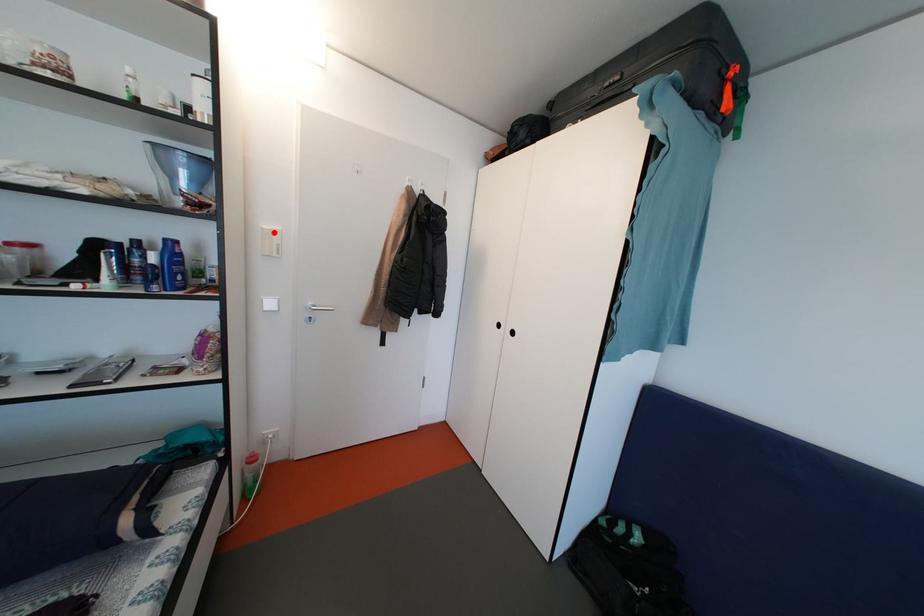
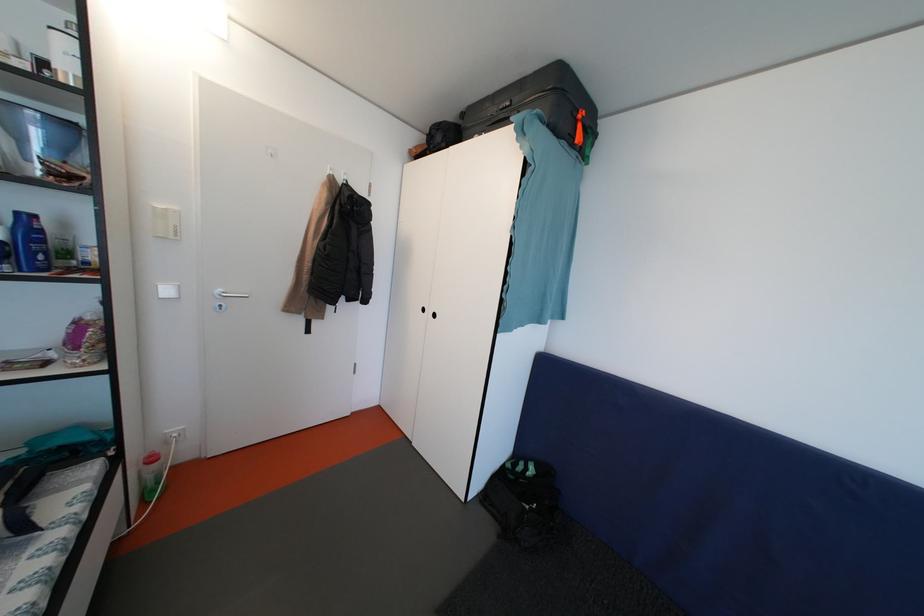
Locate, in the second image, the point that corresponds to the highlighted location in the first image.

(166, 211)